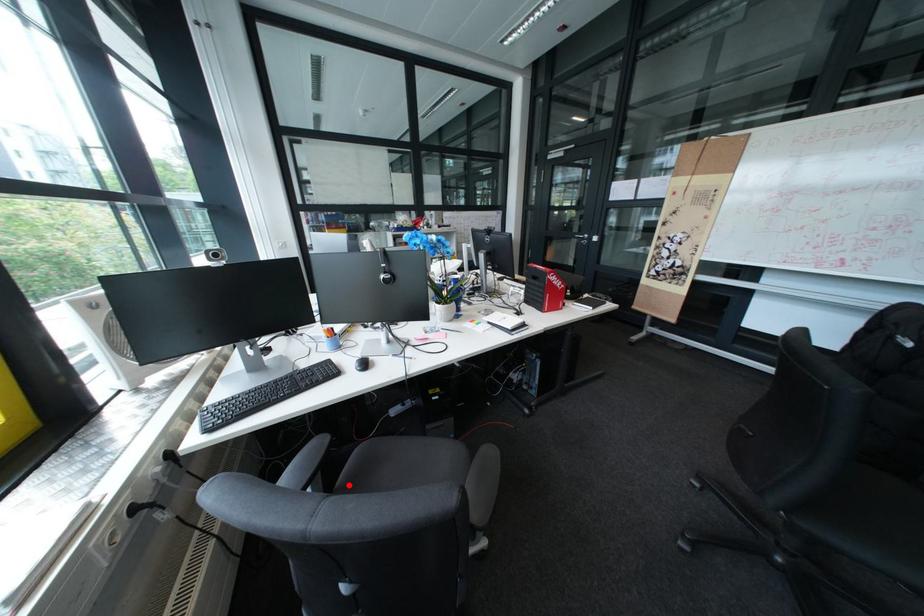
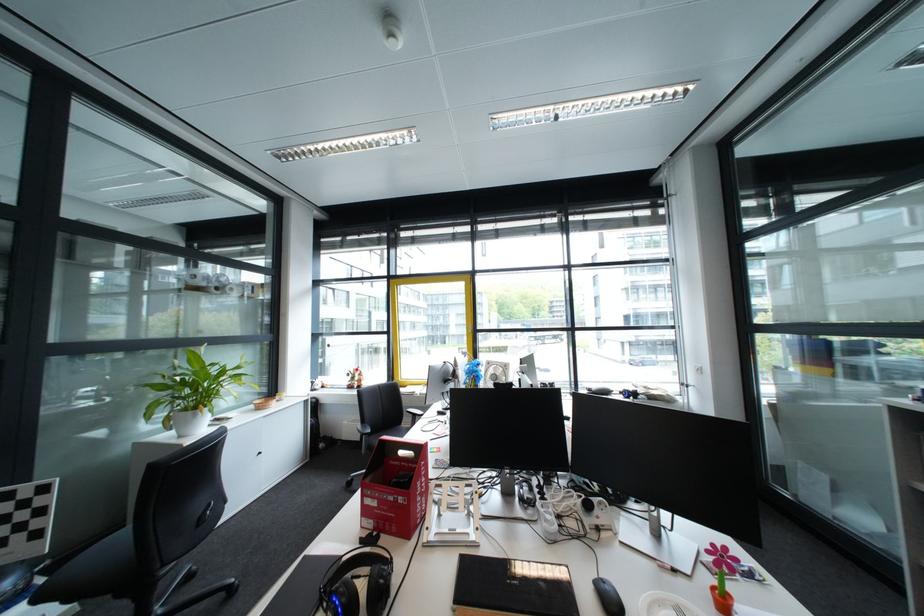
Question: I am providing you with two images of the same scene from different viewpoints. A red point is marked on the first image. Is the red point's position out of view in image 2?

Choices:
 (A) Yes
 (B) No

Answer: (A)